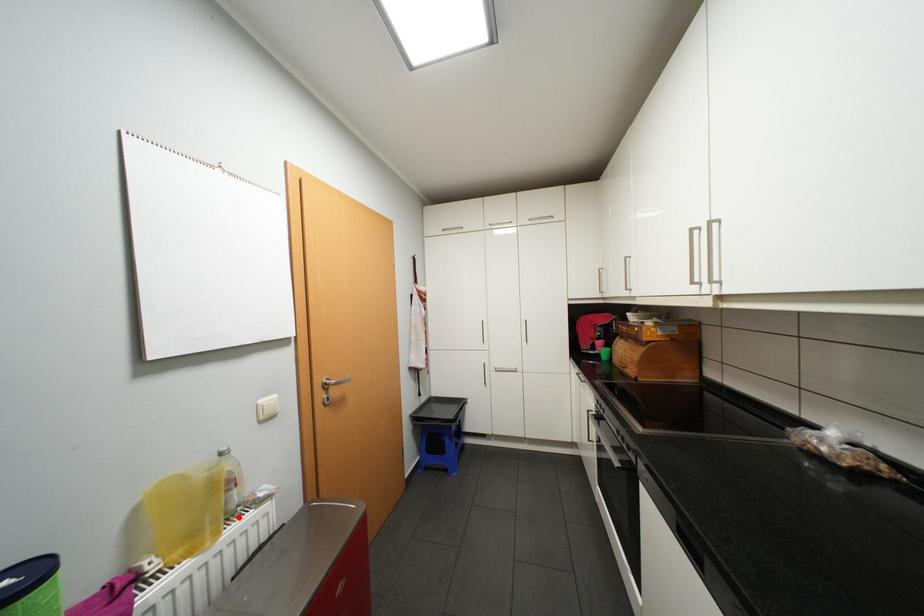
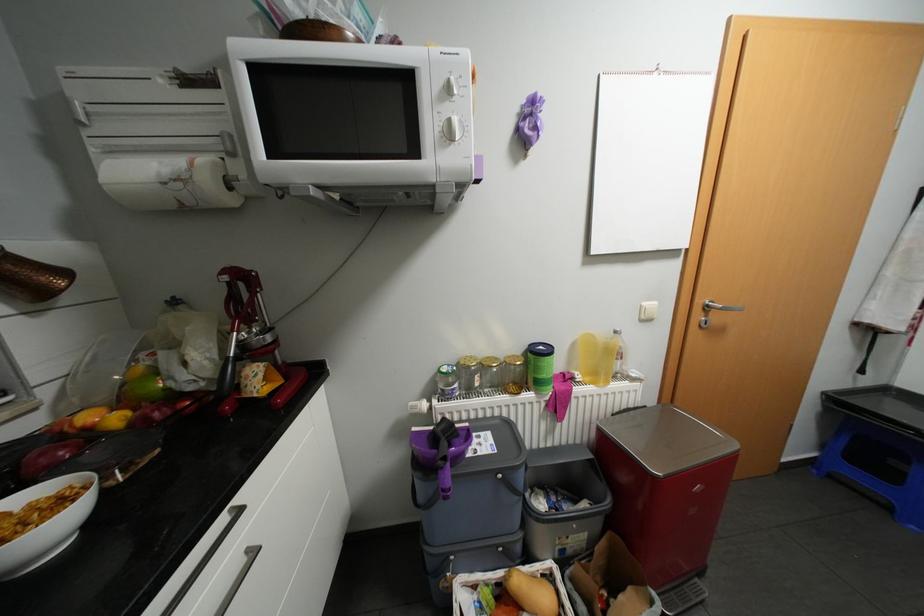
In the second image, find the point that corresponds to the highlighted location in the first image.

(622, 377)